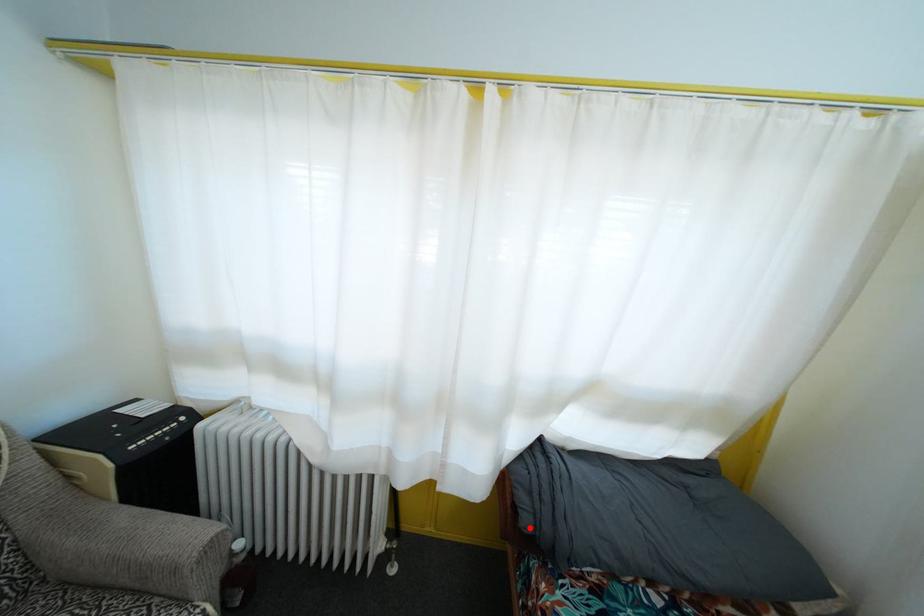
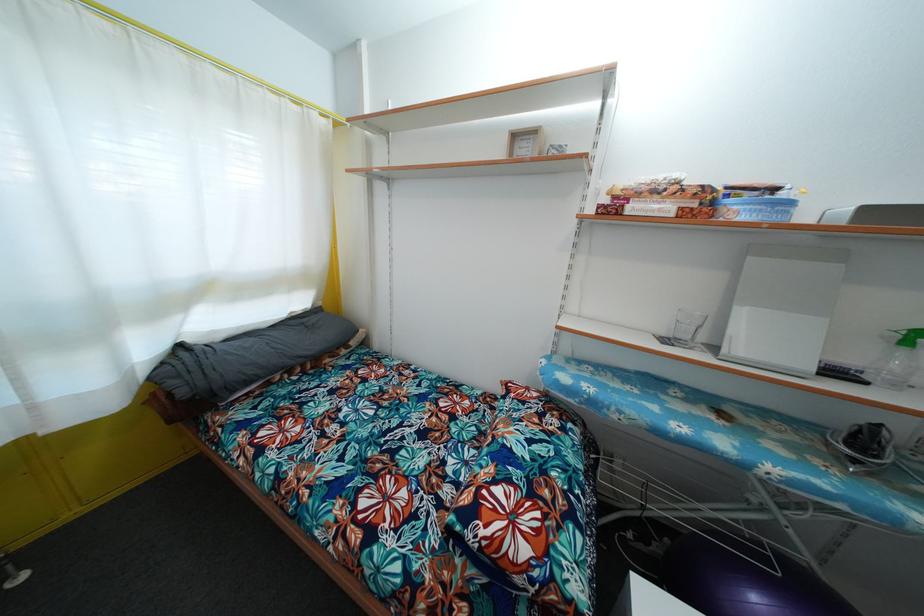
Question: I am providing you with two images of the same scene from different viewpoints. A red point is marked on the first image. At the location where the point appears in image 1, is it still visible in image 2?

Choices:
 (A) Yes
 (B) No

Answer: (A)